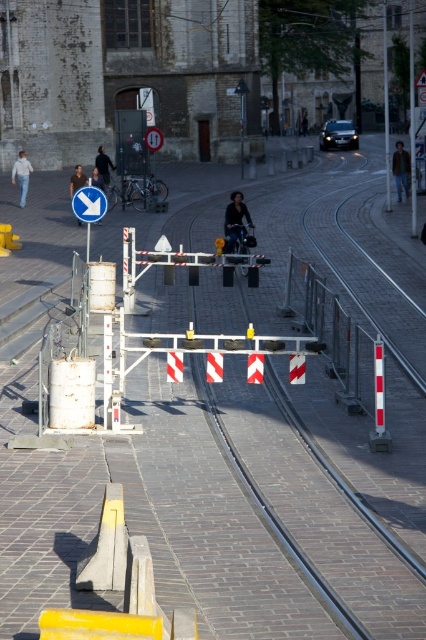
Who is taller, dark blue leather jacket at center or white plastic sign at upper center?

Standing taller between the two is dark blue leather jacket at center.

Does dark blue leather jacket at center come in front of white plastic sign at upper center?

Yes, it is in front of white plastic sign at upper center.

Does point (241, 234) lie in front of point (144, 140)?

Yes, it is.

The width and height of the screenshot is (426, 640). Find the location of `dark blue leather jacket at center`. dark blue leather jacket at center is located at coordinates (236, 221).

Is metallic pole at upper right taller than white plastic arrow at upper left?

Correct, metallic pole at upper right is much taller as white plastic arrow at upper left.

Which is in front, point (416, 192) or point (94, 209)?

Point (94, 209) is in front.

Where is `metallic pole at upper right`? metallic pole at upper right is located at coordinates (411, 122).

From the picture: Who is positioned more to the left, matte blue sign at upper left or dark brown leather jacket at center?

matte blue sign at upper left is more to the left.

Which of these two, matte blue sign at upper left or dark brown leather jacket at center, stands shorter?

With less height is dark brown leather jacket at center.

Between point (71, 179) and point (97, 172), which one is positioned behind?

The point (97, 172) is more distant.

At what (x,y) coordinates should I click in order to perform the action: click on matte blue sign at upper left. Please return your answer as a coordinate pair (x, y). The image size is (426, 640). Looking at the image, I should click on (77, 179).